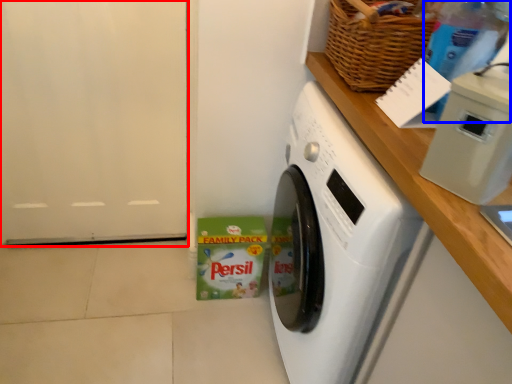
Question: Which of the following is the closest to the observer, door (highlighted by a red box) or bottle (highlighted by a blue box)?

Choices:
 (A) door
 (B) bottle

Answer: (B)